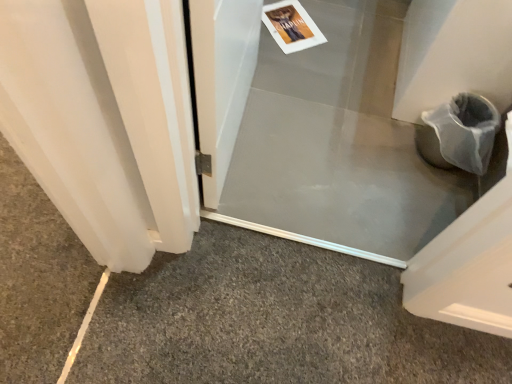
Question: From the image's perspective, is clear plastic screen door at center, marked as the 1th screen door in a front-to-back arrangement, located above or below transparent plastic screen door at center, which is counted as the 1th screen door, starting from the back?

Choices:
 (A) above
 (B) below

Answer: (B)

Question: Considering the relative positions of clear plastic screen door at center, marked as the 1th screen door in a front-to-back arrangement, and transparent plastic screen door at center, which ranks as the 2th screen door in front-to-back order, in the image provided, is clear plastic screen door at center, marked as the 1th screen door in a front-to-back arrangement, to the left or to the right of transparent plastic screen door at center, which ranks as the 2th screen door in front-to-back order,?

Choices:
 (A) right
 (B) left

Answer: (B)

Question: Considering the real-world distances, which object is farthest from the gray carpet at lower left?

Choices:
 (A) clear plastic screen door at center, the second screen door positioned from the back
 (B) transparent plastic screen door at center, which ranks as the 2th screen door in front-to-back order

Answer: (A)

Question: Which object is the closest to the clear plastic screen door at center, marked as the 1th screen door in a front-to-back arrangement?

Choices:
 (A) transparent plastic screen door at center, which ranks as the 2th screen door in front-to-back order
 (B) gray carpet at lower left

Answer: (A)